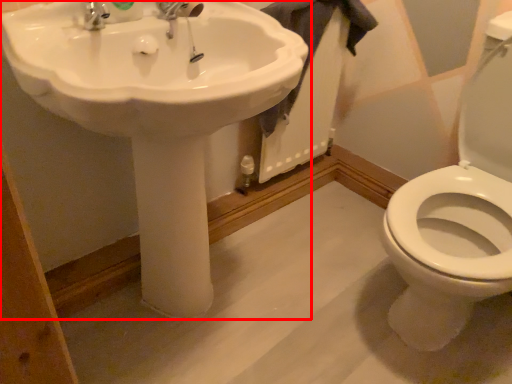
Question: Where is sink (annotated by the red box) located in relation to bath towel in the image?

Choices:
 (A) right
 (B) left

Answer: (B)